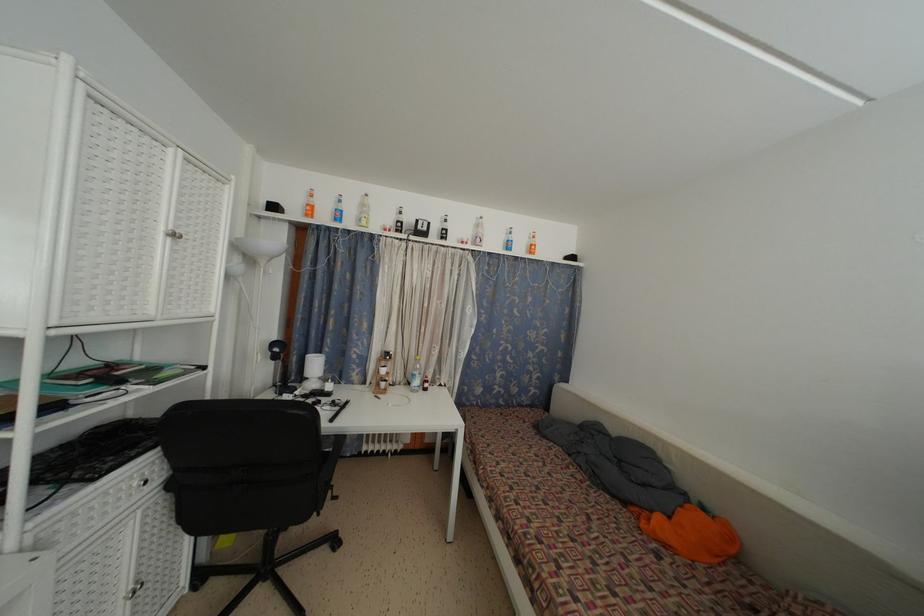
Find where to sit the chair sitting surface. Please return your answer as a coordinate pair (x, y).

(322, 462)